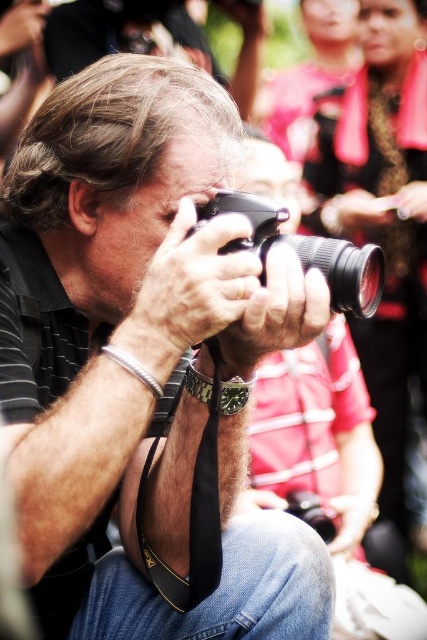
You are a photographer who wants to choose a camera that is easier to carry. Based on the image, which camera between the matte black camera at center and the black plastic camera at center would you recommend?

The black plastic camera at center is smaller in size than the matte black camera at center, so it would be easier to carry.

You are a photographer holding a matte black camera at center and a black plastic camera at center. You need to place them both on a shelf that is 30 centimeters wide. Can you fit both cameras side by side on the shelf?

The matte black camera at center and black plastic camera at center are 29.82 centimeters apart, so yes, they can fit side by side on the 30 centimeter wide shelf since the combined width is slightly less than the shelf width.